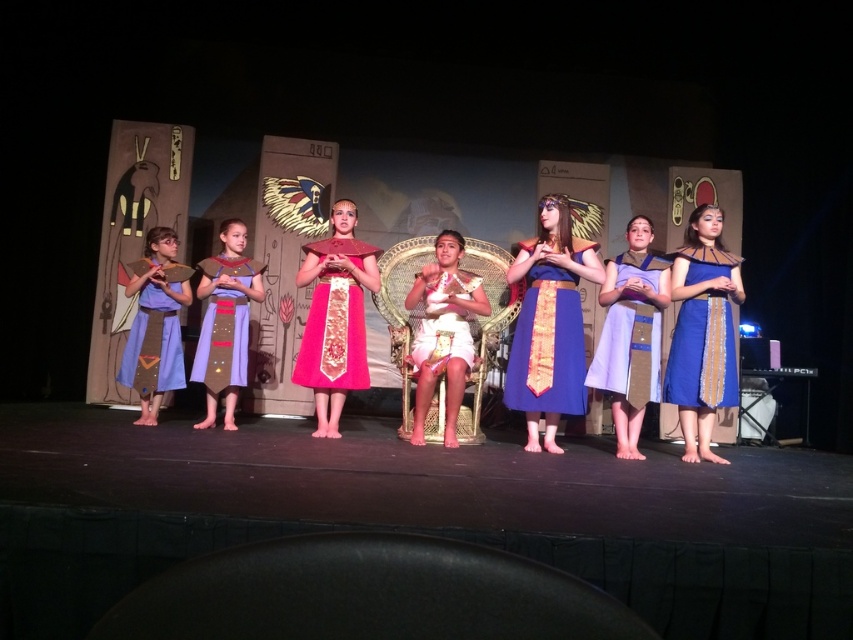
Based on the photo, you are an audience member sitting in the front row of the theater. You notice two performers wearing similar blue dresses. The first is the matte blue fabric dress at left, and the second is the matte blue dress at center. From your perspective, which one is positioned more to the right?

The matte blue dress at center is positioned more to the right compared to the matte blue fabric dress at left.

You are an audience member sitting in the front row of the theater. You want to take a photo of the blue satin dress at center. Where should you aim your camera to capture it?

You should aim your camera at point 0.541 on the horizontal axis and 0.642 on the vertical axis to capture the blue satin dress at center.

You are an event planner arranging a photo shoot for the performers. You need to position the blue satin dress at center and the matte purple fabric dress at center side by side. Which dress requires more horizontal space due to its width?

The blue satin dress at center requires more horizontal space because its width surpasses that of the matte purple fabric dress at center.